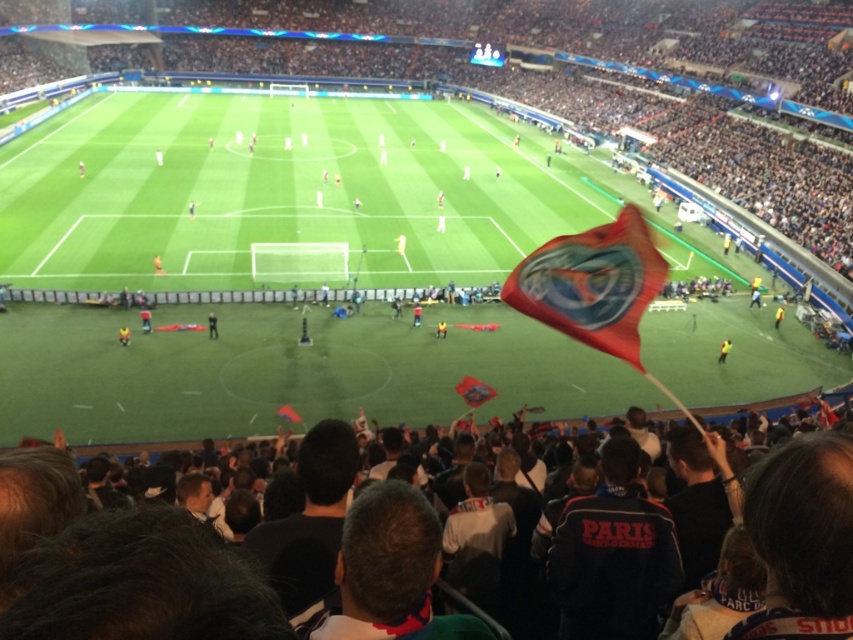
Is dark gray fabric crowd at lower center below red fabric flag at center?

Correct, dark gray fabric crowd at lower center is located below red fabric flag at center.

Does dark gray fabric crowd at lower center have a greater width compared to red fabric flag at center?

Yes.

Does point (322, 596) come in front of point (585, 282)?

Yes, it is in front of point (585, 282).

In order to click on dark gray fabric crowd at lower center in this screenshot , I will do pyautogui.click(x=252, y=573).

Does red fabric flag at center have a lesser width compared to yellow reflective vest at center?

Indeed, red fabric flag at center has a lesser width compared to yellow reflective vest at center.

Does red fabric flag at center have a greater height compared to yellow reflective vest at center?

Incorrect, red fabric flag at center's height is not larger of yellow reflective vest at center's.

You are a GUI agent. You are given a task and a screenshot of the screen. Output one action in this format:
    pyautogui.click(x=<x>, y=<y>)
    Task: Click on the red fabric flag at center
    
    Given the screenshot: What is the action you would take?
    pyautogui.click(x=592, y=284)

At what (x,y) coordinates should I click in order to perform the action: click on red fabric flag at center. Please return your answer as a coordinate pair (x, y). Looking at the image, I should click on (592, 284).

Image resolution: width=853 pixels, height=640 pixels. What do you see at coordinates (212, 324) in the screenshot?
I see `black fabric flag at center` at bounding box center [212, 324].

Does black fabric flag at center have a larger size compared to yellow reflective vest at center?

Indeed, black fabric flag at center has a larger size compared to yellow reflective vest at center.

This screenshot has width=853, height=640. Describe the element at coordinates (212, 324) in the screenshot. I see `black fabric flag at center` at that location.

The height and width of the screenshot is (640, 853). I want to click on black fabric flag at center, so click(x=212, y=324).